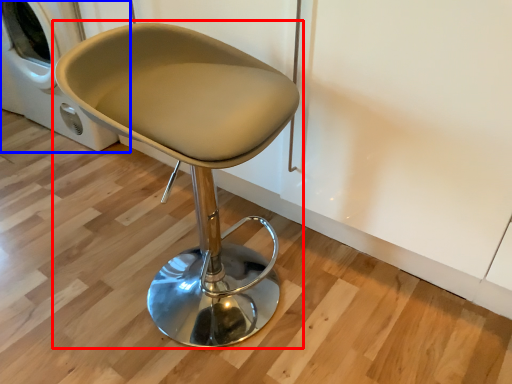
Question: Which object appears closest to the camera in this image, chair (highlighted by a red box) or washing machine (highlighted by a blue box)?

Choices:
 (A) chair
 (B) washing machine

Answer: (A)